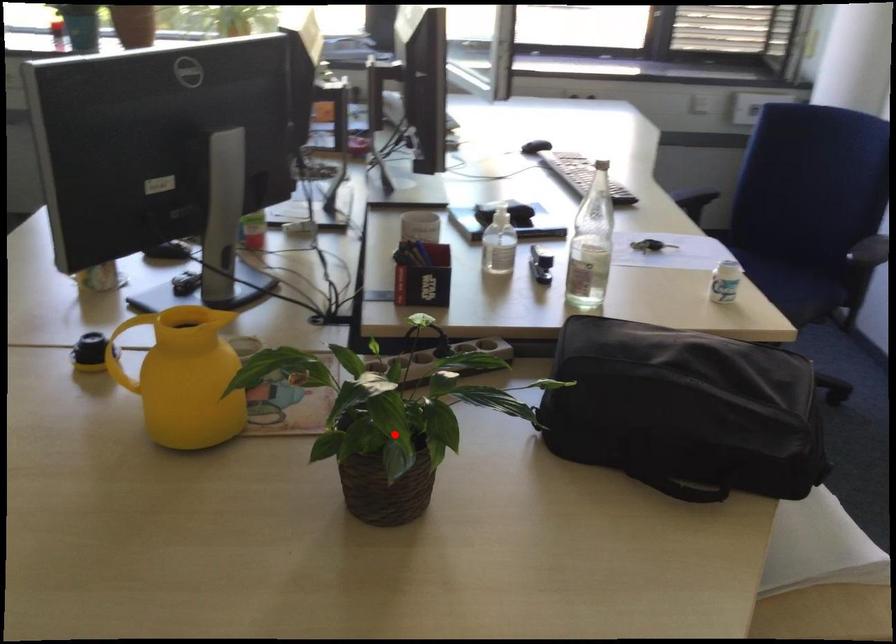
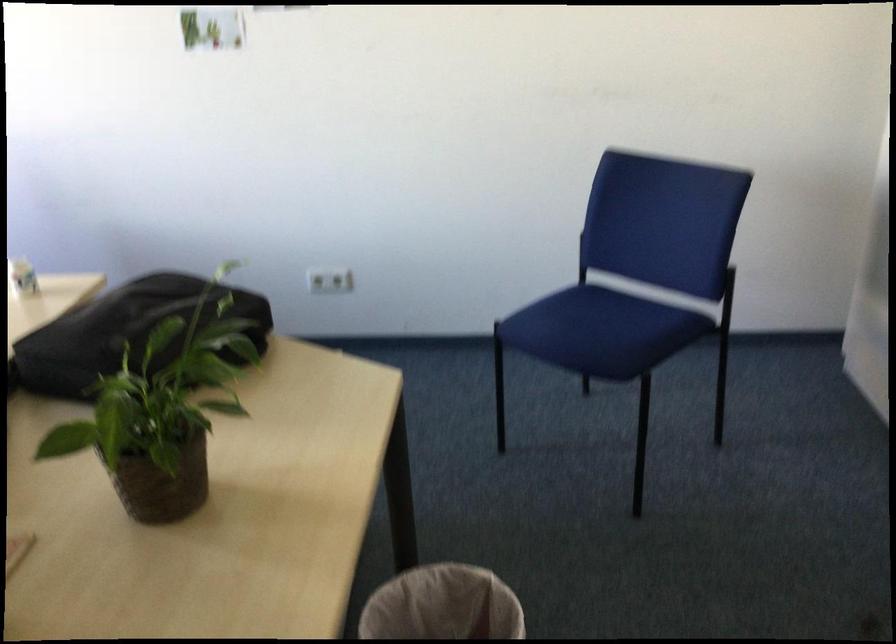
The point at the highlighted location is marked in the first image. Where is the corresponding point in the second image?

(162, 413)